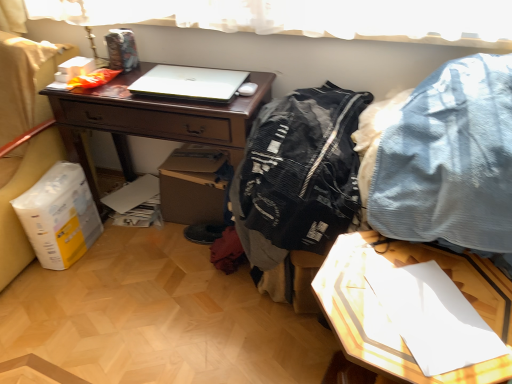
Question: Is white matte laptop at center further to the viewer compared to denim fabric pants at upper right, acting as the 2th clothing starting from the left?

Choices:
 (A) yes
 (B) no

Answer: (A)

Question: From a real-world perspective, is white matte laptop at center under denim fabric pants at upper right, the first clothing when ordered from right to left?

Choices:
 (A) no
 (B) yes

Answer: (B)

Question: Considering the relative sizes of white matte laptop at center and denim fabric pants at upper right, acting as the 2th clothing starting from the left, in the image provided, is white matte laptop at center thinner than denim fabric pants at upper right, acting as the 2th clothing starting from the left,?

Choices:
 (A) yes
 (B) no

Answer: (A)

Question: From a real-world perspective, is white matte laptop at center on denim fabric pants at upper right, the first clothing when ordered from right to left?

Choices:
 (A) yes
 (B) no

Answer: (B)

Question: Is white matte laptop at center in front of denim fabric pants at upper right, acting as the 2th clothing starting from the left?

Choices:
 (A) no
 (B) yes

Answer: (A)

Question: Does white matte laptop at center have a greater width compared to denim fabric pants at upper right, acting as the 2th clothing starting from the left?

Choices:
 (A) yes
 (B) no

Answer: (B)

Question: Considering the relative sizes of black mesh jacket at center, which is counted as the 2th clothing, starting from the right, and white matte laptop at center in the image provided, is black mesh jacket at center, which is counted as the 2th clothing, starting from the right, wider than white matte laptop at center?

Choices:
 (A) yes
 (B) no

Answer: (A)

Question: Could you tell me if black mesh jacket at center, the 1th clothing when ordered from left to right, is turned towards white matte laptop at center?

Choices:
 (A) yes
 (B) no

Answer: (B)

Question: Does black mesh jacket at center, which is counted as the 2th clothing, starting from the right, have a lesser height compared to white matte laptop at center?

Choices:
 (A) yes
 (B) no

Answer: (B)

Question: From the image's perspective, is black mesh jacket at center, which is counted as the 2th clothing, starting from the right, beneath white matte laptop at center?

Choices:
 (A) yes
 (B) no

Answer: (A)

Question: Is black mesh jacket at center, which is counted as the 2th clothing, starting from the right, further to camera compared to white matte laptop at center?

Choices:
 (A) no
 (B) yes

Answer: (A)

Question: From a real-world perspective, is black mesh jacket at center, which is counted as the 2th clothing, starting from the right, located beneath white matte laptop at center?

Choices:
 (A) no
 (B) yes

Answer: (B)

Question: Is black mesh jacket at center, the 1th clothing when ordered from left to right, oriented towards denim fabric pants at upper right, acting as the 2th clothing starting from the left?

Choices:
 (A) yes
 (B) no

Answer: (B)